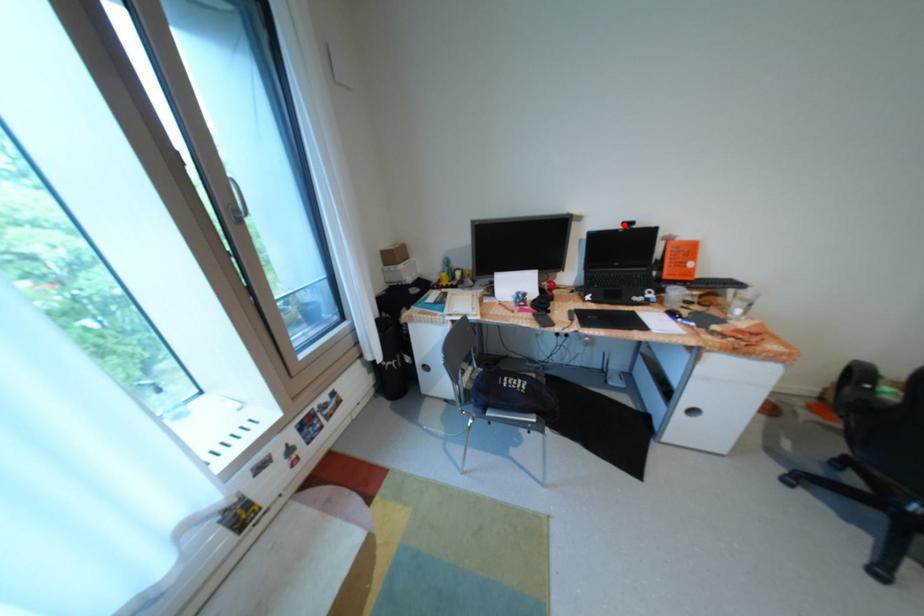
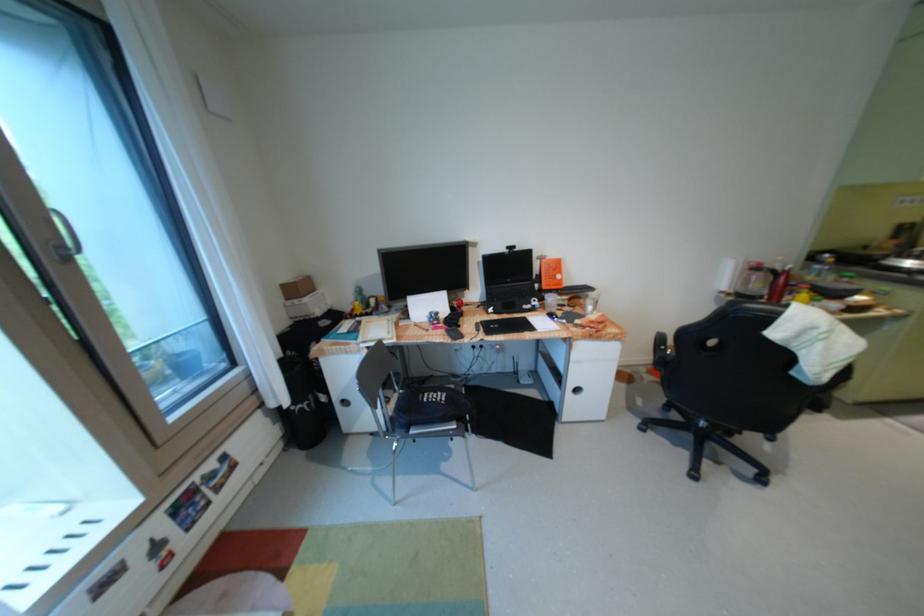
The point at the highlighted location is marked in the first image. Where is the corresponding point in the second image?

(512, 249)